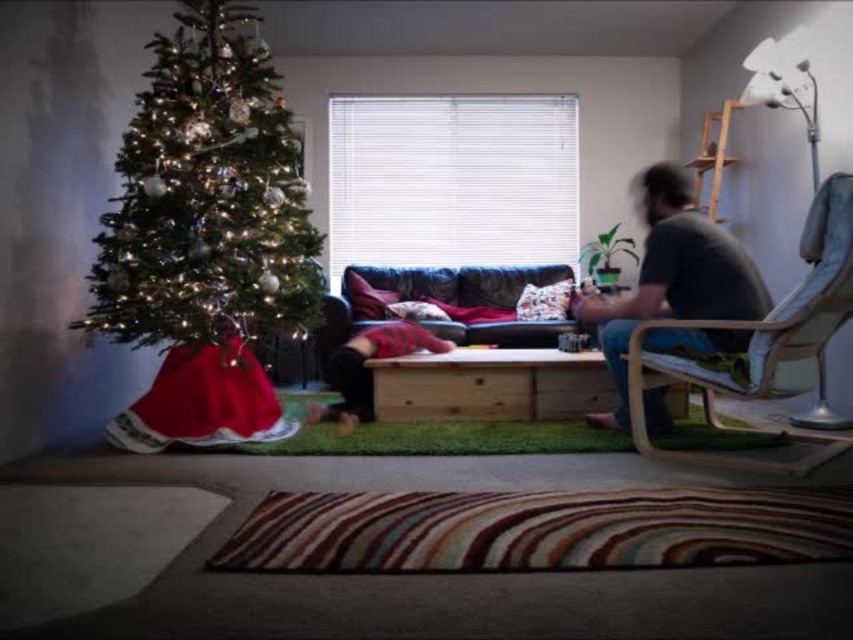
Consider the image. Can you confirm if gray matte shirt at right is positioned above leather couch at center?

Actually, gray matte shirt at right is below leather couch at center.

Between gray matte shirt at right and leather couch at center, which one is positioned lower?

gray matte shirt at right is below.

Which is in front, point (664, 216) or point (321, 368)?

Point (664, 216) is in front.

Locate an element on the screen. The image size is (853, 640). gray matte shirt at right is located at coordinates (672, 276).

Is point (178, 120) less distant than point (636, 321)?

No, it is behind (636, 321).

How much distance is there between green matte christmas tree at left and gray matte shirt at right?

The distance of green matte christmas tree at left from gray matte shirt at right is 5.85 feet.

Who is more distant from viewer, (x=183, y=310) or (x=764, y=294)?

Positioned behind is point (x=183, y=310).

This screenshot has width=853, height=640. I want to click on green matte christmas tree at left, so click(x=207, y=196).

Which is above, gray matte shirt at right or striped sweater at center?

gray matte shirt at right is above.

Does point (685, 253) come farther from viewer compared to point (341, 429)?

No, (685, 253) is in front of (341, 429).

In order to click on gray matte shirt at right in this screenshot , I will do `click(672, 276)`.